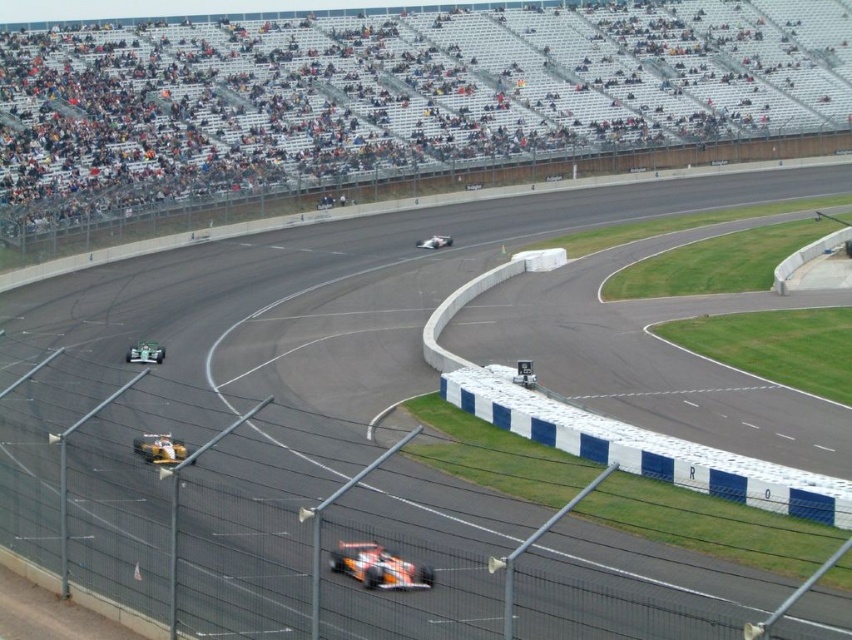
Is orange metallic race car at lower center positioned behind white glossy race car at center?

That is False.

Measure the distance between point (407,573) and camera.

Point (407,573) and camera are 36.28 feet apart from each other.

Describe the element at coordinates (378, 566) in the screenshot. I see `orange metallic race car at lower center` at that location.

Where is `orange metallic race car at lower center`? Image resolution: width=852 pixels, height=640 pixels. orange metallic race car at lower center is located at coordinates (378, 566).

Can you confirm if orange metallic race car at lower left is wider than white glossy race car at center?

Incorrect, orange metallic race car at lower left's width does not surpass white glossy race car at center's.

Is orange metallic race car at lower left to the right of white glossy race car at center from the viewer's perspective?

In fact, orange metallic race car at lower left is to the left of white glossy race car at center.

Between point (128, 358) and point (452, 237), which one is positioned behind?

The point (452, 237) is behind.

At what (x,y) coordinates should I click in order to perform the action: click on orange metallic race car at lower left. Please return your answer as a coordinate pair (x, y). This screenshot has width=852, height=640. Looking at the image, I should click on (145, 353).

Who is higher up, yellow matte race car at lower left or orange metallic race car at lower left?

yellow matte race car at lower left is higher up.

Between yellow matte race car at lower left and orange metallic race car at lower left, which one appears on the left side from the viewer's perspective?

orange metallic race car at lower left

Image resolution: width=852 pixels, height=640 pixels. Identify the location of yellow matte race car at lower left. (159, 449).